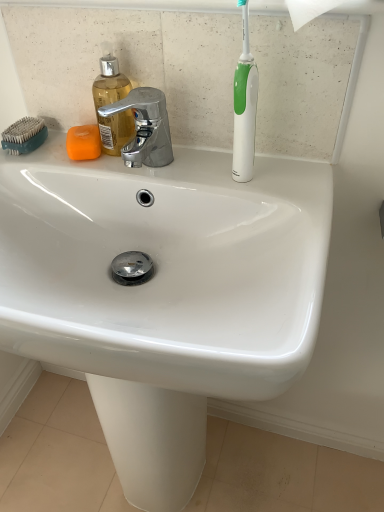
This screenshot has width=384, height=512. What do you see at coordinates (111, 103) in the screenshot? I see `translucent plastic soap dispenser at upper left` at bounding box center [111, 103].

What do you see at coordinates (145, 128) in the screenshot? The image size is (384, 512). I see `polished chrome faucet at upper center` at bounding box center [145, 128].

Find the location of a particular element. This screenshot has width=384, height=512. teal plastic comb at upper left is located at coordinates (24, 135).

Is white glossy sink at center oriented away from teal plastic comb at upper left?

No, white glossy sink at center's orientation is not away from teal plastic comb at upper left.

From the image's perspective, who appears lower, white glossy sink at center or teal plastic comb at upper left?

white glossy sink at center appears lower in the image.

Locate an element on the screen. sink on the right side of teal plastic comb at upper left is located at coordinates (x=164, y=293).

Is white glossy sink at center not within teal plastic comb at upper left?

white glossy sink at center is positioned outside teal plastic comb at upper left.

Considering the sizes of objects white glossy sink at center and white glossy toothbrush at upper right in the image provided, who is wider, white glossy sink at center or white glossy toothbrush at upper right?

white glossy sink at center.

Is white glossy sink at center outside of white glossy toothbrush at upper right?

Yes, white glossy sink at center is located beyond the bounds of white glossy toothbrush at upper right.

From the picture: Considering the positions of objects white glossy sink at center and white glossy toothbrush at upper right in the image provided, who is more to the left, white glossy sink at center or white glossy toothbrush at upper right?

From the viewer's perspective, white glossy sink at center appears more on the left side.

Does white glossy sink at center have a greater height compared to white glossy toothbrush at upper right?

Yes, white glossy sink at center is taller than white glossy toothbrush at upper right.

Considering the sizes of white glossy toothbrush at upper right and white glossy sink at center in the image, is white glossy toothbrush at upper right wider or thinner than white glossy sink at center?

Clearly, white glossy toothbrush at upper right has less width compared to white glossy sink at center.

Is white glossy toothbrush at upper right taller than white glossy sink at center?

No, white glossy toothbrush at upper right is not taller than white glossy sink at center.

Consider the image. Is white glossy toothbrush at upper right oriented towards white glossy sink at center?

No, white glossy toothbrush at upper right is not facing towards white glossy sink at center.

Find the location of a particular element. The image size is (384, 512). toothbrush behind the white glossy sink at center is located at coordinates (244, 106).

From the image's perspective, which is below, translucent plastic soap dispenser at upper left or teal plastic comb at upper left?

teal plastic comb at upper left appears lower in the image.

Considering the positions of objects translucent plastic soap dispenser at upper left and teal plastic comb at upper left in the image provided, who is more to the right, translucent plastic soap dispenser at upper left or teal plastic comb at upper left?

From the viewer's perspective, translucent plastic soap dispenser at upper left appears more on the right side.

From the picture: Which of these two, translucent plastic soap dispenser at upper left or teal plastic comb at upper left, stands taller?

translucent plastic soap dispenser at upper left is taller.

Is translucent plastic soap dispenser at upper left aimed at teal plastic comb at upper left?

No, translucent plastic soap dispenser at upper left is not aimed at teal plastic comb at upper left.

Considering the relative sizes of teal plastic comb at upper left and white glossy toothbrush at upper right in the image provided, is teal plastic comb at upper left thinner than white glossy toothbrush at upper right?

In fact, teal plastic comb at upper left might be wider than white glossy toothbrush at upper right.

Does teal plastic comb at upper left turn towards white glossy toothbrush at upper right?

No, teal plastic comb at upper left is not aimed at white glossy toothbrush at upper right.

Which of these two, teal plastic comb at upper left or white glossy toothbrush at upper right, stands shorter?

Standing shorter between the two is teal plastic comb at upper left.

Which object is positioned more to the left, teal plastic comb at upper left or white glossy toothbrush at upper right?

teal plastic comb at upper left is more to the left.

Considering the relative positions of teal plastic comb at upper left and translucent plastic soap dispenser at upper left in the image provided, is teal plastic comb at upper left to the left of translucent plastic soap dispenser at upper left from the viewer's perspective?

Yes.

Is teal plastic comb at upper left turned away from translucent plastic soap dispenser at upper left?

No.

Is teal plastic comb at upper left completely or partially outside of translucent plastic soap dispenser at upper left?

Yes.

Image resolution: width=384 pixels, height=512 pixels. Identify the location of comb behind the translucent plastic soap dispenser at upper left. (24, 135).

Does teal plastic comb at upper left have a lesser width compared to white glossy sink at center?

Yes, teal plastic comb at upper left is thinner than white glossy sink at center.

Is there a large distance between teal plastic comb at upper left and white glossy sink at center?

Actually, teal plastic comb at upper left and white glossy sink at center are a little close together.

Between teal plastic comb at upper left and white glossy sink at center, which one appears on the left side from the viewer's perspective?

teal plastic comb at upper left.

Considering their positions, is teal plastic comb at upper left located in front of or behind white glossy sink at center?

teal plastic comb at upper left is positioned farther from the viewer than white glossy sink at center.

Locate an element on the screen. This screenshot has height=512, width=384. sink on the right of teal plastic comb at upper left is located at coordinates (164, 293).

This screenshot has width=384, height=512. What are the coordinates of `sink on the left of the white glossy toothbrush at upper right` in the screenshot? It's located at (164, 293).

From the image, which object appears to be nearer to polished chrome faucet at upper center, orange matte soap at upper left or translucent plastic soap dispenser at upper left?

Among the two, translucent plastic soap dispenser at upper left is located nearer to polished chrome faucet at upper center.

Which object lies further to the anchor point teal plastic comb at upper left, white glossy sink at center or white glossy toothbrush at upper right?

The object further to teal plastic comb at upper left is white glossy sink at center.

Considering their positions, is polished chrome faucet at upper center positioned further to white glossy toothbrush at upper right than orange matte soap at upper left?

orange matte soap at upper left lies further to white glossy toothbrush at upper right than the other object.

Considering their positions, is teal plastic comb at upper left positioned further to white glossy sink at center than translucent plastic soap dispenser at upper left?

teal plastic comb at upper left.

Estimate the real-world distances between objects in this image. Which object is closer to teal plastic comb at upper left, white glossy sink at center or orange matte soap at upper left?

orange matte soap at upper left lies closer to teal plastic comb at upper left than the other object.

Considering their positions, is translucent plastic soap dispenser at upper left positioned further to polished chrome faucet at upper center than white glossy toothbrush at upper right?

white glossy toothbrush at upper right is positioned further to the anchor polished chrome faucet at upper center.

From the image, which object appears to be nearer to translucent plastic soap dispenser at upper left, polished chrome faucet at upper center or orange matte soap at upper left?

polished chrome faucet at upper center is positioned closer to the anchor translucent plastic soap dispenser at upper left.

From the image, which object appears to be nearer to orange matte soap at upper left, white glossy sink at center or white glossy toothbrush at upper right?

white glossy toothbrush at upper right.

I want to click on soap dispenser positioned between polished chrome faucet at upper center and orange matte soap at upper left from near to far, so click(111, 103).

Identify the location of tap between teal plastic comb at upper left and white glossy toothbrush at upper right. The width and height of the screenshot is (384, 512). (145, 128).

Where is `tap between orange matte soap at upper left and white glossy toothbrush at upper right in the horizontal direction`? tap between orange matte soap at upper left and white glossy toothbrush at upper right in the horizontal direction is located at coordinates (145, 128).

At what (x,y) coordinates should I click in order to perform the action: click on tap between translucent plastic soap dispenser at upper left and white glossy sink at center vertically. Please return your answer as a coordinate pair (x, y). The width and height of the screenshot is (384, 512). Looking at the image, I should click on pos(145,128).